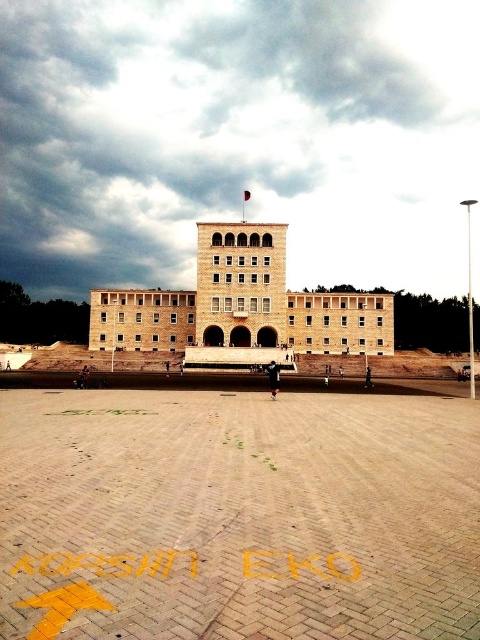
Can you confirm if beige stone building at center is positioned to the right of brown brick tower at center?

Incorrect, beige stone building at center is not on the right side of brown brick tower at center.

Does beige stone building at center come in front of brown brick tower at center?

Yes, beige stone building at center is closer to the viewer.

The image size is (480, 640). What do you see at coordinates (241, 304) in the screenshot?
I see `beige stone building at center` at bounding box center [241, 304].

This screenshot has height=640, width=480. In order to click on beige stone building at center in this screenshot , I will do `click(241, 304)`.